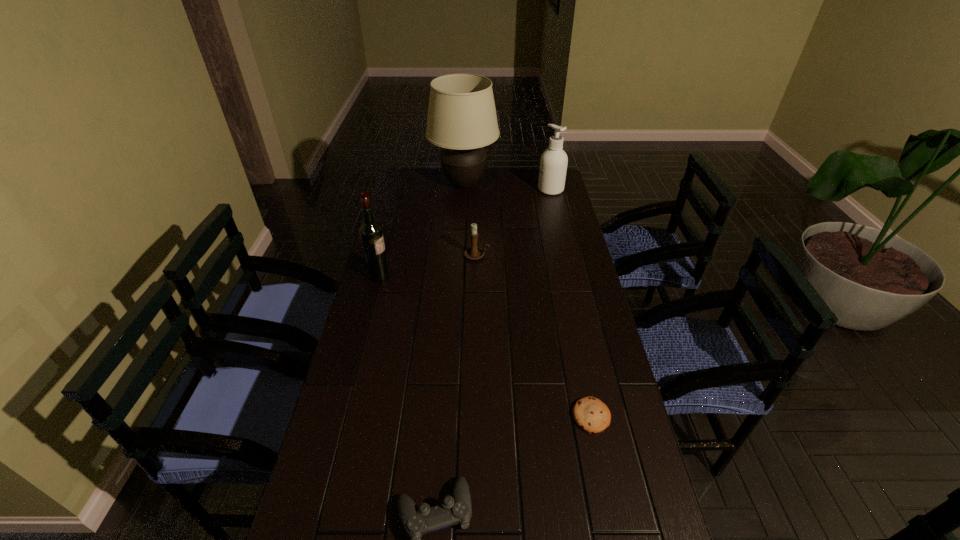
I want to click on blank region between the cleansing agent and the lampshade, so click(x=507, y=187).

You are a GUI agent. You are given a task and a screenshot of the screen. Output one action in this format:
    pyautogui.click(x=<x>, y=<y>)
    Task: Click on the empty space that is in between the cookie and the cleansing agent
    The image size is (960, 540).
    Given the screenshot: What is the action you would take?
    pyautogui.click(x=571, y=303)

What are the coordinates of `object that is the closest to the nearest object` in the screenshot? It's located at (590, 414).

Locate which object is the third closest to the cleansing agent. Please provide its 2D coordinates. Your answer should be formatted as a tuple, i.e. [(x, y)], where the tuple contains the x and y coordinates of a point satisfying the conditions above.

[(371, 234)]